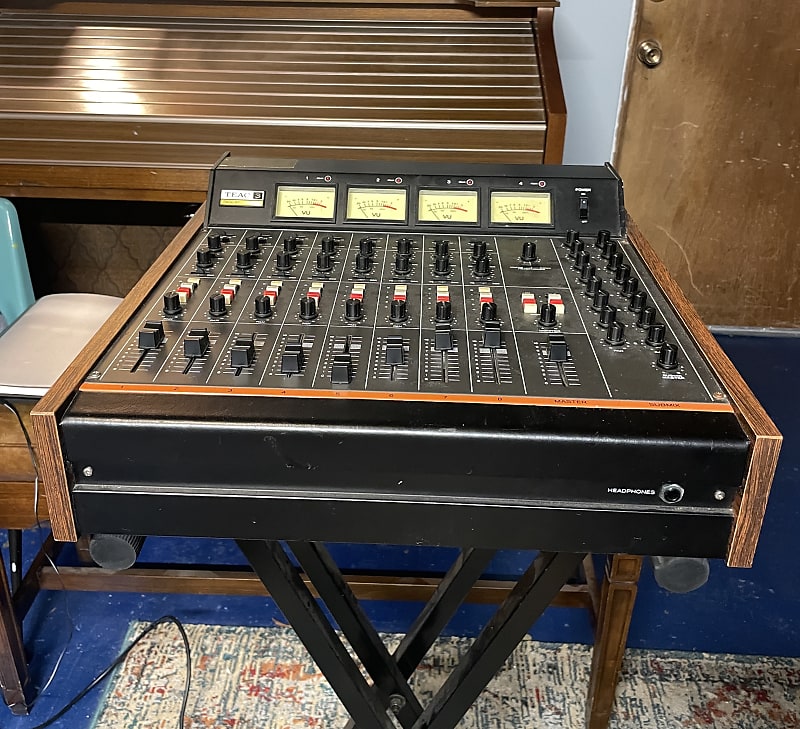
Find the location of `piano cover`. piano cover is located at coordinates (185, 93).